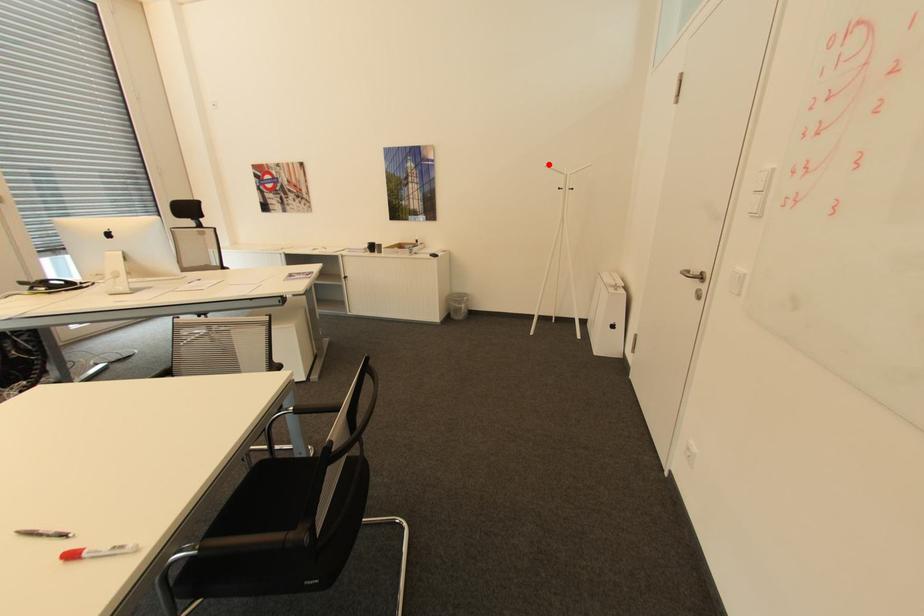
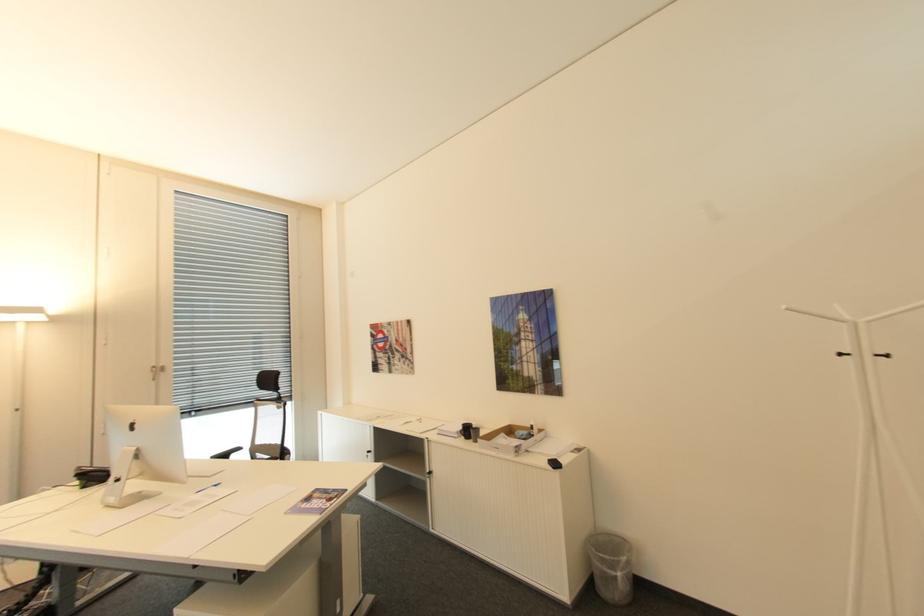
Locate, in the second image, the point that corresponds to the highlighted location in the first image.

(791, 307)